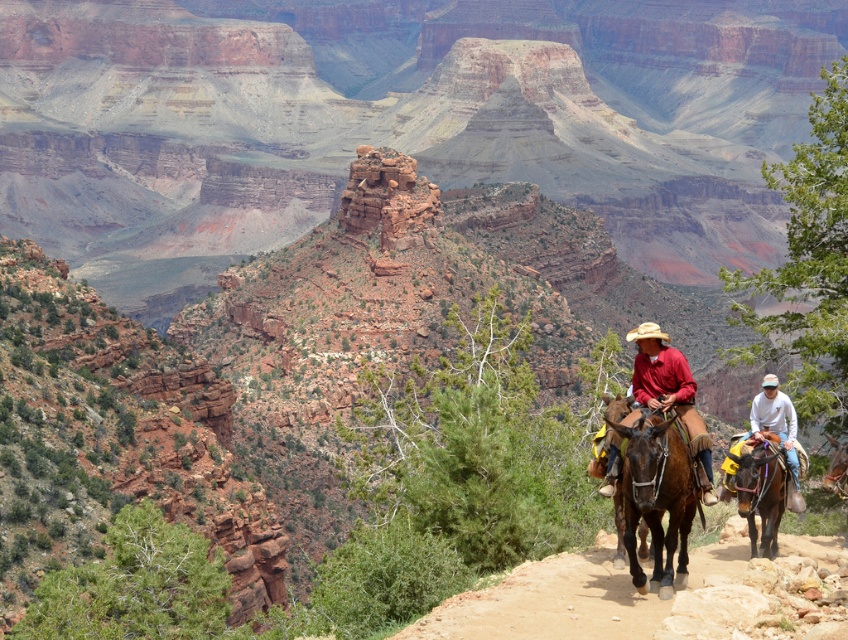
Question: Which of these objects is positioned farthest from the brown leather horse at right?

Choices:
 (A) brown glossy horse at center
 (B) brown leather saddle at lower right

Answer: (B)

Question: Considering the real-world distances, which object is farthest from the brown leather horse at right?

Choices:
 (A) white cotton shirt at upper right
 (B) matte red shirt at center

Answer: (B)

Question: Is brown leather horse at right above white cotton shirt at upper right?

Choices:
 (A) yes
 (B) no

Answer: (B)

Question: Is brown glossy horse at center wider than matte red shirt at center?

Choices:
 (A) no
 (B) yes

Answer: (A)

Question: Which point appears closest to the camera in this image?

Choices:
 (A) (656, 512)
 (B) (679, 392)
 (C) (735, 486)
 (D) (791, 413)

Answer: (A)

Question: Can you confirm if brown glossy horse at center is bigger than brown leather saddle at lower right?

Choices:
 (A) no
 (B) yes

Answer: (B)